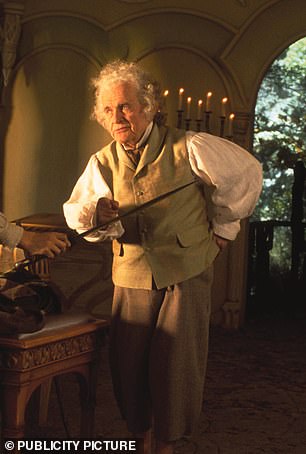
Find the location of a particular element. arched entryway is located at coordinates (275, 56).